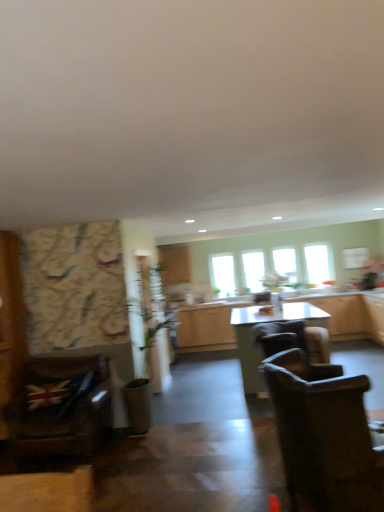
Question: Looking at the image, does dark brown fabric chair at lower right, the second chair from the left, seem bigger or smaller compared to transparent glass window at center, which appears as the 3th window when viewed from the right?

Choices:
 (A) small
 (B) big

Answer: (B)

Question: From their relative heights in the image, would you say dark brown fabric chair at lower right, the second chair from the left, is taller or shorter than transparent glass window at center, which appears as the second window when viewed from the left?

Choices:
 (A) short
 (B) tall

Answer: (B)

Question: Which object is positioned farthest from the transparent glass window at center, arranged as the first window when viewed from the left?

Choices:
 (A) dark brown fabric chair at lower right, the second chair from the left
 (B) transparent glass window at center, which appears as the 3th window when viewed from the right
 (C) clear glass window at center, which is counted as the 3th window, starting from the left
 (D) velvet brown armchair at left, which is counted as the 2th chair, starting from the front
 (E) transparent glass window at upper right, arranged as the fourth window when viewed from the left

Answer: (A)

Question: Which object is positioned closest to the transparent glass window at upper right, arranged as the fourth window when viewed from the left?

Choices:
 (A) transparent glass window at center, arranged as the first window when viewed from the left
 (B) clear glass window at center, which is counted as the 3th window, starting from the left
 (C) brown leather chair at center, which is counted as the first chair, starting from the back
 (D) dark brown fabric chair at lower right, acting as the third chair starting from the back
 (E) transparent glass window at center, which appears as the 3th window when viewed from the right

Answer: (B)